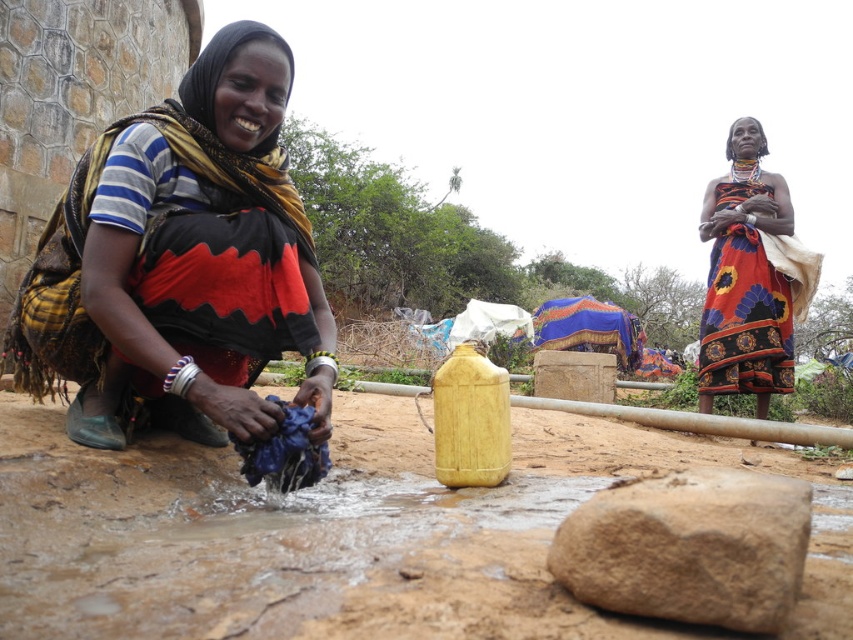
Which is more to the right, matte black scarf at lower left or floral fabric dress at center?

floral fabric dress at center

Is point (233, 68) positioned after point (698, 228)?

No, it is not.

Image resolution: width=853 pixels, height=640 pixels. In order to click on matte black scarf at lower left in this screenshot , I will do `click(180, 262)`.

Is point (654, 589) farther from viewer compared to point (750, 157)?

No, (654, 589) is in front of (750, 157).

Locate an element on the screen. brown rough rock at lower center is located at coordinates (689, 547).

Can you confirm if matte black scarf at lower left is thinner than brown rough rock at lower center?

No, matte black scarf at lower left is not thinner than brown rough rock at lower center.

Is point (161, 355) closer to camera compared to point (785, 509)?

No.

This screenshot has width=853, height=640. What are the coordinates of `matte black scarf at lower left` in the screenshot? It's located at (180, 262).

The width and height of the screenshot is (853, 640). Identify the location of matte black scarf at lower left. (180, 262).